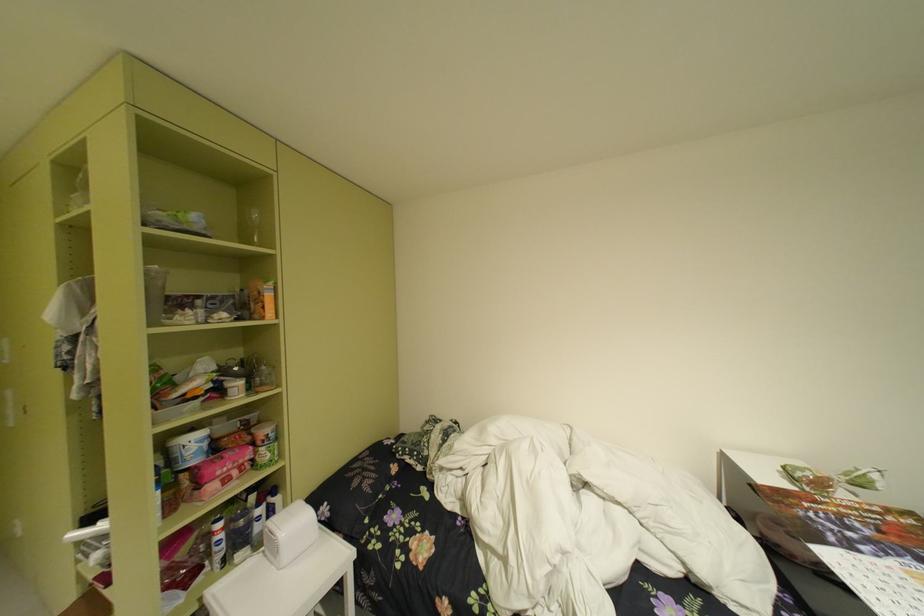
The height and width of the screenshot is (616, 924). What do you see at coordinates (238, 535) in the screenshot?
I see `the blue spray can nozzle` at bounding box center [238, 535].